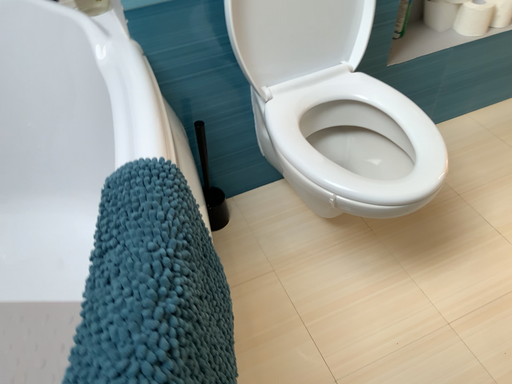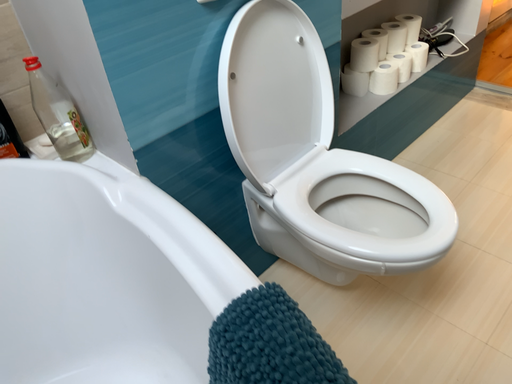
Question: How did the camera likely rotate when shooting the video?

Choices:
 (A) rotated downward
 (B) rotated upward

Answer: (B)